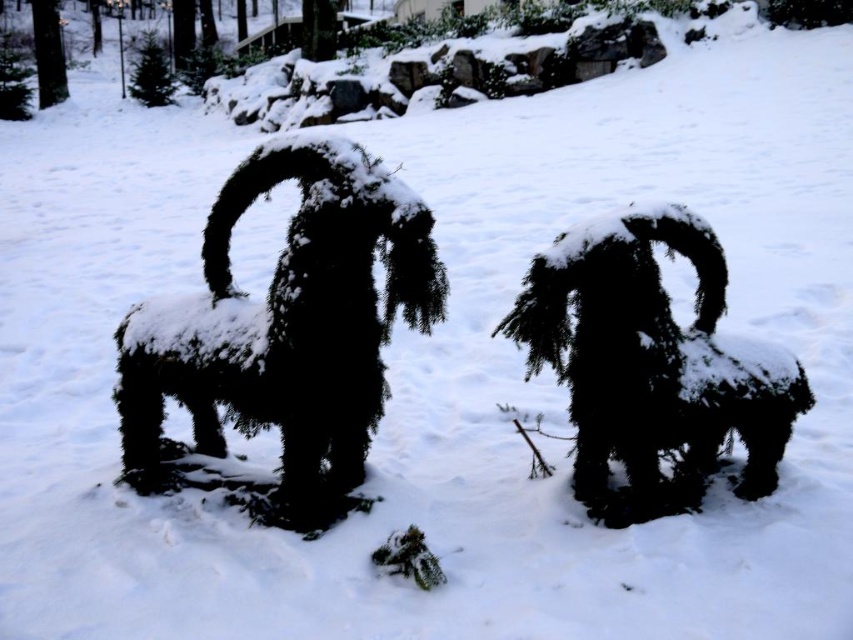
You are standing in the snowy area and want to walk towards the green textured evergreen at center and the fuzzy dark green bush at center. Which one will you reach first?

The green textured evergreen at center is in front of the fuzzy dark green bush at center, so you will reach the green textured evergreen at center first.

You are standing at the center of the snowy area and want to find the green textured evergreen at center. Based on the coordinates provided, in which direction should you move to locate it?

The green textured evergreen at center is located at coordinates point (x=285, y=330), so you should move towards the center direction to find it.

You are an artist planning to paint the snowy scene. You want to include both the green textured evergreen at center and the fuzzy dark green bush at center. Which one should you make larger in your painting to accurately represent their sizes?

The green textured evergreen at center should be painted larger than the fuzzy dark green bush at center because it is larger in size according to the description.